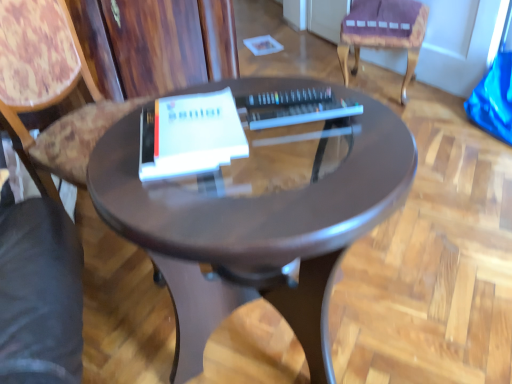
Question: From the image's perspective, is wooden at left, arranged as the 1th chair when viewed from the front, above or below purple fabric cushion at upper right, the 2th chair viewed from the front?

Choices:
 (A) below
 (B) above

Answer: (A)

Question: Would you say wooden at left, which ranks as the 2th chair in right-to-left order, is inside or outside purple fabric cushion at upper right, the 2th chair viewed from the front?

Choices:
 (A) inside
 (B) outside

Answer: (B)

Question: Which of these objects is positioned closest to the wooden at left, which ranks as the 2th chair in right-to-left order?

Choices:
 (A) glossy brown table at center
 (B) white matte paperback book at center
 (C) purple fabric cushion at upper right, the 1th chair from the right

Answer: (B)

Question: Estimate the real-world distances between objects in this image. Which object is farther from the white matte paperback book at center?

Choices:
 (A) glossy brown table at center
 (B) purple fabric cushion at upper right, the 2th chair when ordered from left to right
 (C) wooden at left, arranged as the 1th chair when viewed from the front

Answer: (B)